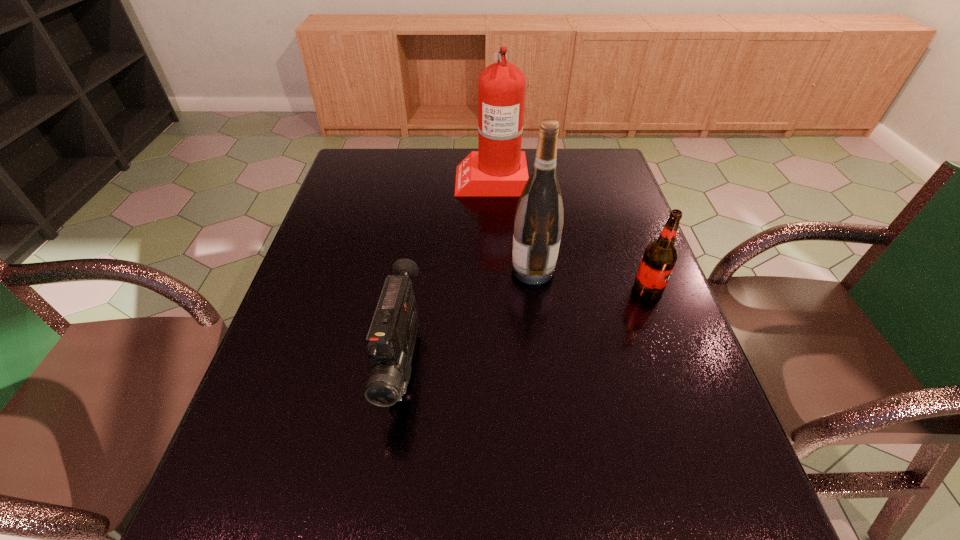
Identify the location of fire extinguisher. (499, 168).

Locate an element on the screen. This screenshot has width=960, height=540. wine bottle is located at coordinates (538, 222).

Locate an element on the screen. root beer is located at coordinates (659, 259).

You are a GUI agent. You are given a task and a screenshot of the screen. Output one action in this format:
    pyautogui.click(x=<x>, y=<y>)
    Task: Click on the second shortest object
    
    Given the screenshot: What is the action you would take?
    pyautogui.click(x=659, y=259)

Where is `the leftmost object`? the leftmost object is located at coordinates (390, 341).

I want to click on the nearest object, so click(x=390, y=341).

The image size is (960, 540). I want to click on free space located 0.240m on the front-facing side of the fire extinguisher, so click(x=382, y=179).

Where is `vacant space situated 0.320m on the front-facing side of the fire extinguisher`? The height and width of the screenshot is (540, 960). vacant space situated 0.320m on the front-facing side of the fire extinguisher is located at coordinates (357, 179).

Where is `vacant space situated 0.090m on the front-facing side of the fire extinguisher`? vacant space situated 0.090m on the front-facing side of the fire extinguisher is located at coordinates (428, 179).

Where is `free space located on the label of the wine bottle`? free space located on the label of the wine bottle is located at coordinates (359, 270).